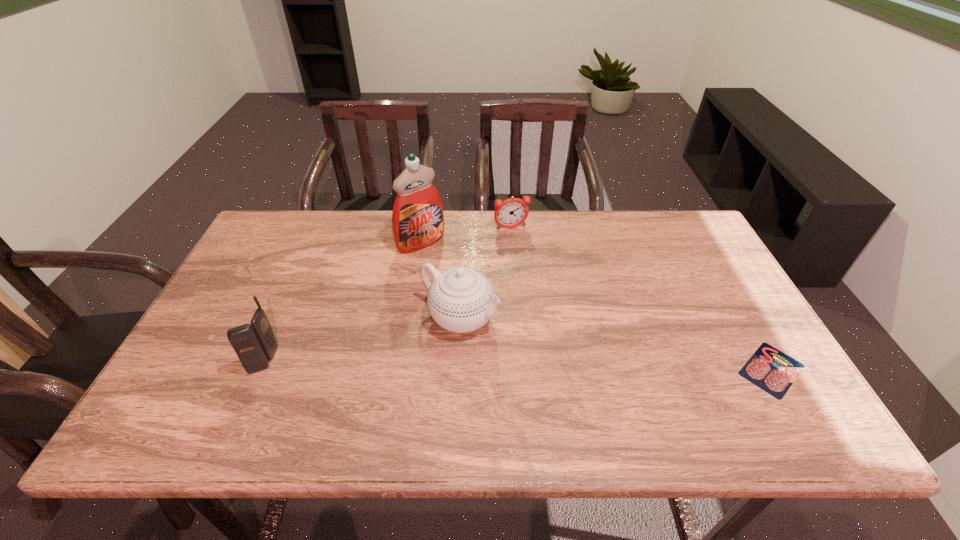
I want to click on free space on the desktop that is between the leftmost object and the rightmost object and is positioned on the spout of the chinaware, so click(549, 366).

This screenshot has width=960, height=540. I want to click on vacant space on the desktop that is between the cellular telephone and the rightmost object and is positioned on the front surface of the detergent, so click(553, 366).

The image size is (960, 540). Identify the location of vacant space on the desktop that is between the leftmost object and the shortest object and is positioned on the front-facing side of the alarm clock. (574, 366).